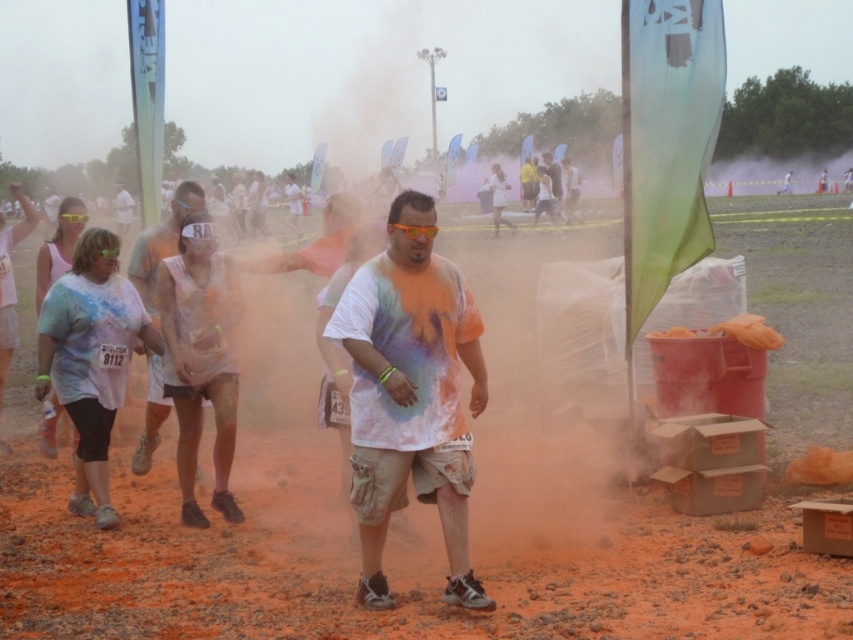
Does multicolored tie-dye shirt at center have a larger size compared to white tie-dye shirt at center?

Incorrect, multicolored tie-dye shirt at center is not larger than white tie-dye shirt at center.

Locate an element on the screen. The image size is (853, 640). multicolored tie-dye shirt at center is located at coordinates (161, 243).

The height and width of the screenshot is (640, 853). Find the location of `multicolored tie-dye shirt at center`. multicolored tie-dye shirt at center is located at coordinates (161, 243).

Who is more distant from viewer, (445, 410) or (126, 204)?

The point (126, 204) is behind.

Is tie-dye t-shirt at center below white tie-dye shirt at center?

Correct, tie-dye t-shirt at center is located below white tie-dye shirt at center.

Does point (450, 394) come behind point (120, 228)?

No, (450, 394) is closer to viewer.

This screenshot has height=640, width=853. What are the coordinates of `tie-dye t-shirt at center` in the screenshot? It's located at (410, 394).

Does tie-dye t-shirt at center have a smaller size compared to multicolored tie-dye shirt at center?

Incorrect, tie-dye t-shirt at center is not smaller in size than multicolored tie-dye shirt at center.

Which is below, tie-dye t-shirt at center or multicolored tie-dye shirt at center?

tie-dye t-shirt at center is below.

This screenshot has width=853, height=640. I want to click on tie-dye t-shirt at center, so click(x=410, y=394).